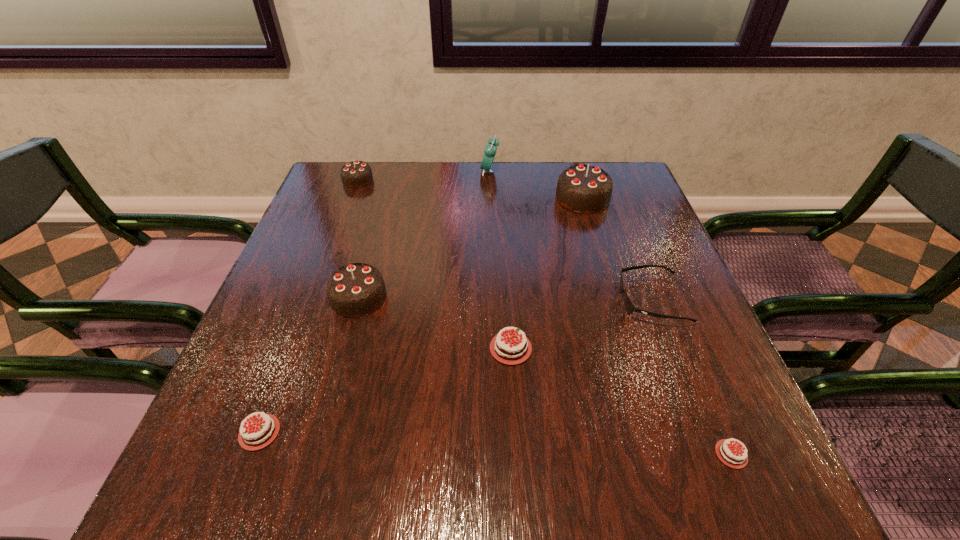
Where is `object positioned at the far right corner`? The height and width of the screenshot is (540, 960). object positioned at the far right corner is located at coordinates (586, 189).

You are a GUI agent. You are given a task and a screenshot of the screen. Output one action in this format:
    pyautogui.click(x=<x>, y=<y>)
    Task: Click on the object that is at the near right corner
    
    Given the screenshot: What is the action you would take?
    pyautogui.click(x=731, y=456)

Where is `free region at the far edge of the desktop`? The width and height of the screenshot is (960, 540). free region at the far edge of the desktop is located at coordinates (467, 166).

In the image, there is a desktop. Where is `vacant space at the near edge`? This screenshot has width=960, height=540. vacant space at the near edge is located at coordinates (343, 477).

Image resolution: width=960 pixels, height=540 pixels. I want to click on vacant space at the left edge, so click(325, 324).

You are a GUI agent. You are given a task and a screenshot of the screen. Output one action in this format:
    pyautogui.click(x=<x>, y=<y>)
    Task: Click on the blank space at the right edge of the desktop
    This screenshot has height=540, width=960.
    Given the screenshot: What is the action you would take?
    pyautogui.click(x=635, y=231)

Find the location of a particular element. The width and height of the screenshot is (960, 540). free space at the far right corner is located at coordinates (623, 181).

Where is `free space between the biggest red chocolate cake and the sunglasses`? free space between the biggest red chocolate cake and the sunglasses is located at coordinates (581, 324).

Locate an element on the screen. vacant area between the smallest chocolate chocolate cake and the second biggest red chocolate cake is located at coordinates (309, 306).

Where is `vacant area between the third chocolate cake from right to left and the alarm clock`? vacant area between the third chocolate cake from right to left and the alarm clock is located at coordinates (x=500, y=260).